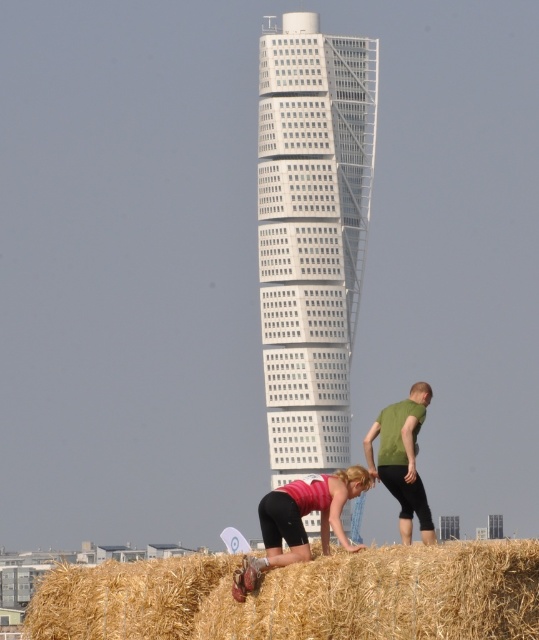
Question: Does matte pink shirt at lower center have a greater width compared to green matte shirt at lower right?

Choices:
 (A) no
 (B) yes

Answer: (B)

Question: Considering the relative positions of golden straw bale at lower center and matte pink shirt at lower center in the image provided, where is golden straw bale at lower center located with respect to matte pink shirt at lower center?

Choices:
 (A) right
 (B) left

Answer: (B)

Question: Which point is farther to the camera?

Choices:
 (A) (349, 106)
 (B) (321, 628)

Answer: (A)

Question: Which point is closer to the camera?

Choices:
 (A) (295, 518)
 (B) (105, 618)
 (C) (410, 483)

Answer: (A)

Question: Considering the real-world distances, which object is closest to the golden straw bale at lower center?

Choices:
 (A) matte pink shirt at lower center
 (B) green matte shirt at lower right
 (C) white glass tower at center
 (D) white glass building at center

Answer: (A)

Question: Is white glass building at center below golden straw bale at lower center?

Choices:
 (A) no
 (B) yes

Answer: (A)